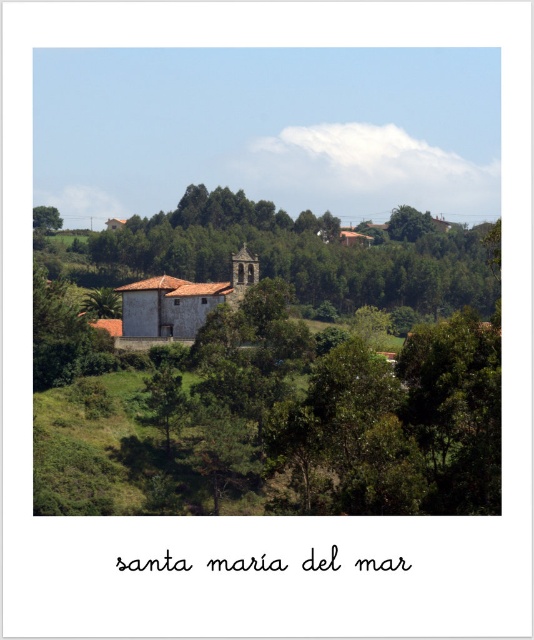
You are standing in the rural landscape and want to take a photo. There are two points marked in the scene, point (215, 294) and point (160, 337). Which point is closer to you?

Point (215, 294) is closer to the camera than point (160, 337), so it is closer to you.

You are an architect designing a new garden path that needs to pass between the green leafy tree at center and the brown wooden church at center. Given that the path must be at least 2 meters wide to accommodate a wheelchair, can the existing space between them accommodate this requirement?

The green leafy tree at center is bigger than the brown wooden church at center, but the description does not provide specific measurements of the distance between them. Therefore, it is impossible to determine if the existing space is wide enough for a 2 meter path without additional information.

You are standing in the rural landscape and want to take a photo of the brown wooden church at center. However, there is a green leafy tree at center blocking your view. Which direction should you move to get an unobstructed view of the church?

The green leafy tree at center is to the right of the brown wooden church at center. To get an unobstructed view, you should move to the left side of the tree so that the tree is no longer blocking the church.